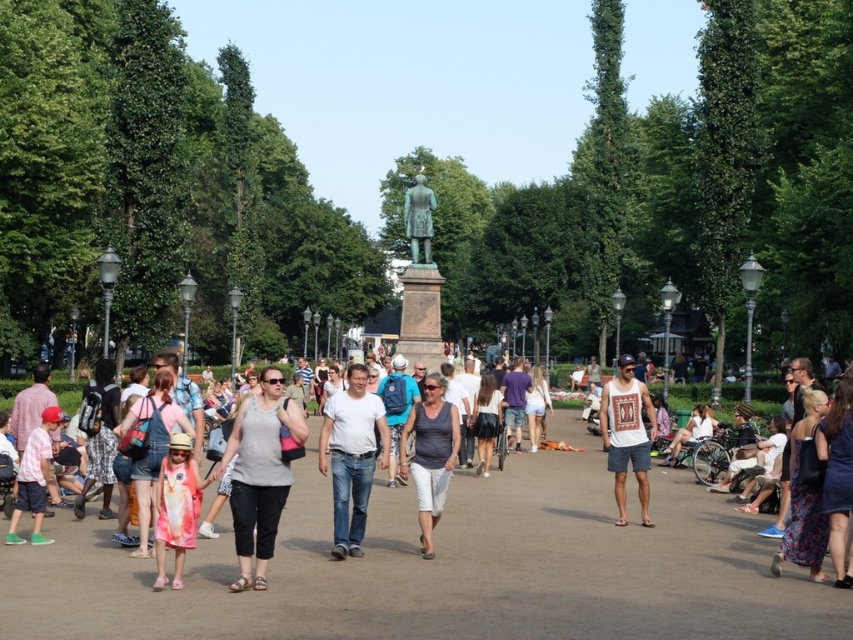
Question: Which of the following is the closest to the observer?

Choices:
 (A) (828, 428)
 (B) (334, 456)
 (C) (244, 524)
 (D) (534, 400)

Answer: (C)

Question: Can you confirm if brown sand path at center is positioned above matte pink shirt at lower left?

Choices:
 (A) no
 (B) yes

Answer: (A)

Question: Which of these objects is positioned farthest from the purple cotton shirt at center?

Choices:
 (A) pink fabric dress at center
 (B) matte pink shirt at lower left
 (C) gray cotton tank top at center

Answer: (B)

Question: Among these objects, which one is farthest from the camera?

Choices:
 (A) matte gray tank top at center
 (B) matte pink shirt at lower left
 (C) denim shorts at center

Answer: (C)

Question: Does white cotton shirt at center appear on the right side of matte pink shirt at lower left?

Choices:
 (A) yes
 (B) no

Answer: (A)

Question: Does dark blue dress at lower right have a smaller size compared to matte pink shirt at lower left?

Choices:
 (A) yes
 (B) no

Answer: (A)